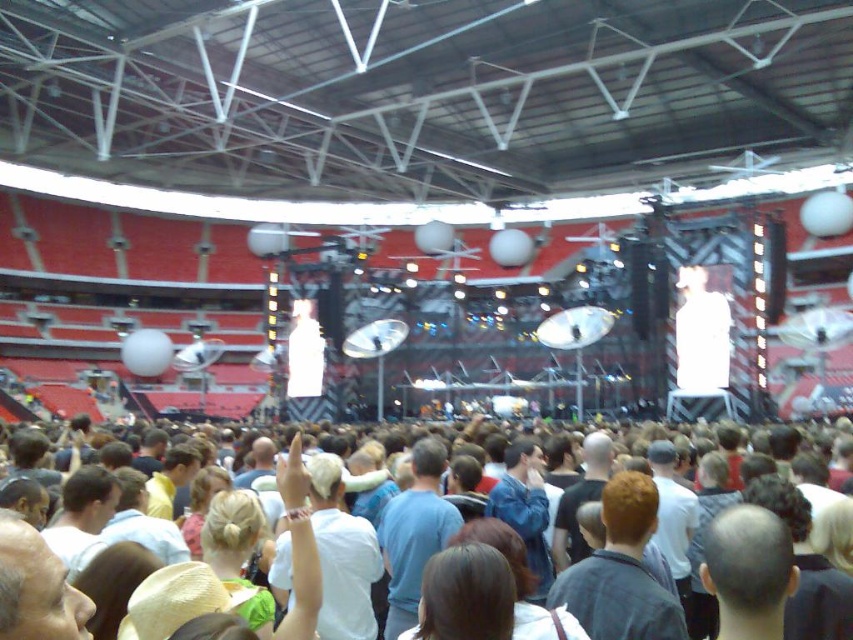
Consider the image. Between white cotton crowd at center and dark gray shirt at center, which one is positioned higher?

white cotton crowd at center

Is white cotton crowd at center closer to camera compared to dark gray shirt at center?

Yes, white cotton crowd at center is closer to the viewer.

I want to click on white cotton crowd at center, so click(801, 435).

Is light brown hair at lower left taller than blue denim jacket at center?

No, light brown hair at lower left is not taller than blue denim jacket at center.

Who is taller, light brown hair at lower left or blue denim jacket at center?

Standing taller between the two is blue denim jacket at center.

Is point (19, 584) positioned in front of point (537, 477)?

Yes, it is in front of point (537, 477).

The height and width of the screenshot is (640, 853). Identify the location of light brown hair at lower left. (36, 588).

Which of these two, dark gray shirt at center or white matte shirt at center, stands taller?

Standing taller between the two is white matte shirt at center.

Is dark gray shirt at center bigger than white matte shirt at center?

No, dark gray shirt at center is not bigger than white matte shirt at center.

Where is `dark gray shirt at center`? This screenshot has width=853, height=640. dark gray shirt at center is located at coordinates (621, 572).

Identify the location of dark gray shirt at center. (621, 572).